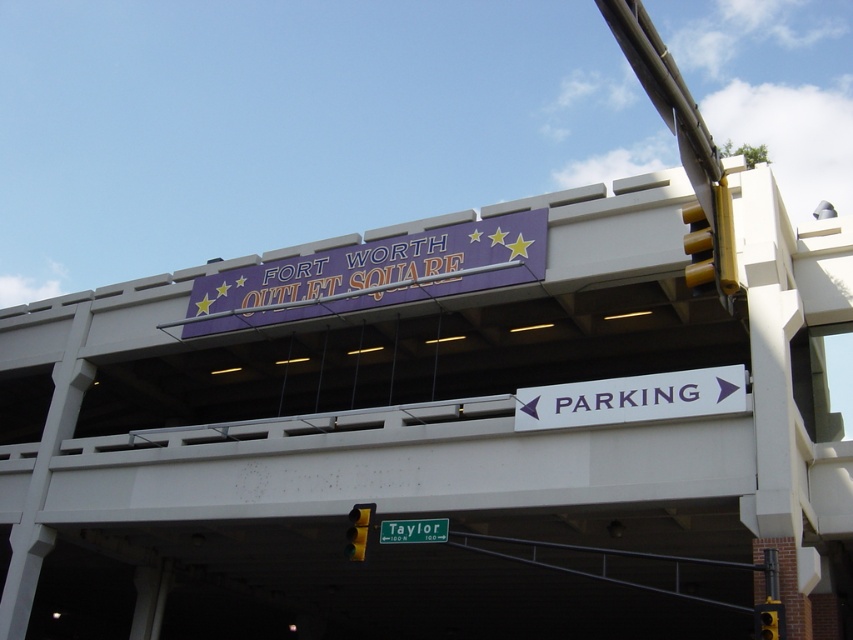
Question: Does green metallic street sign at lower center appear over yellow plastic traffic light at upper right?

Choices:
 (A) yes
 (B) no

Answer: (A)

Question: Is white plastic parking sign at lower center thinner than yellow plastic traffic light at upper right?

Choices:
 (A) yes
 (B) no

Answer: (A)

Question: Is white plastic parking sign at lower center positioned in front of yellow plastic traffic light at lower center?

Choices:
 (A) no
 (B) yes

Answer: (A)

Question: Which of the following is the closest to the observer?

Choices:
 (A) (360, 548)
 (B) (416, 538)
 (C) (486, 221)

Answer: (A)

Question: Estimate the real-world distances between objects in this image. Which object is farther from the white plastic parking sign at lower center?

Choices:
 (A) yellow plastic traffic light at upper right
 (B) green metallic street sign at lower center
 (C) yellow plastic traffic light at lower center

Answer: (C)

Question: Estimate the real-world distances between objects in this image. Which object is closer to the purple glossy sign at upper center?

Choices:
 (A) white plastic parking sign at lower center
 (B) yellow plastic traffic light at lower center
 (C) yellow plastic traffic light at upper right
 (D) green metallic street sign at lower center

Answer: (B)